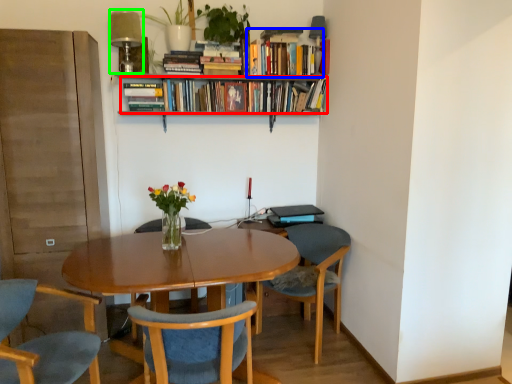
Question: Estimate the real-world distances between objects in this image. Which object is closer to book (highlighted by a red box), book (highlighted by a blue box) or lamp (highlighted by a green box)?

Choices:
 (A) book
 (B) lamp

Answer: (A)